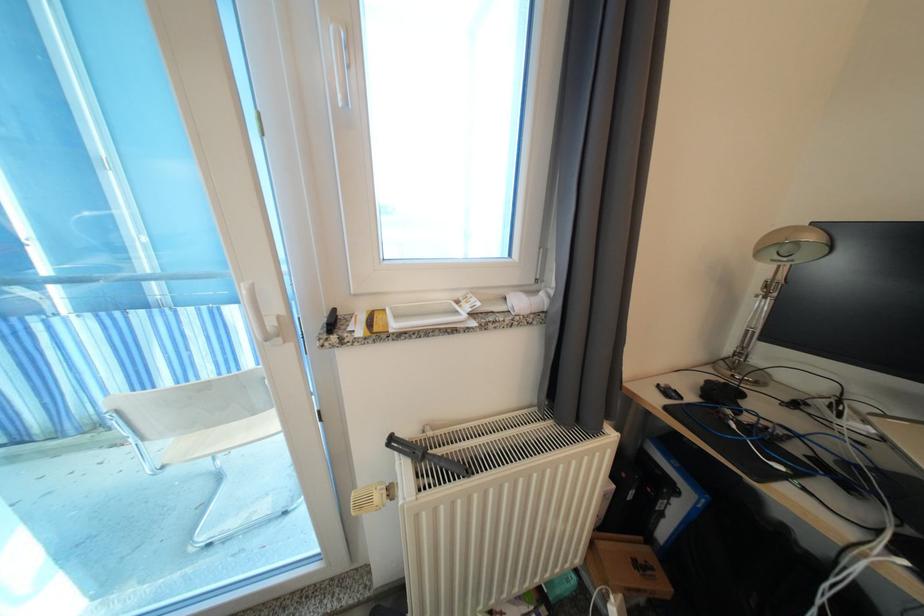
This screenshot has width=924, height=616. In order to click on black game controller in this screenshot , I will do `click(424, 455)`.